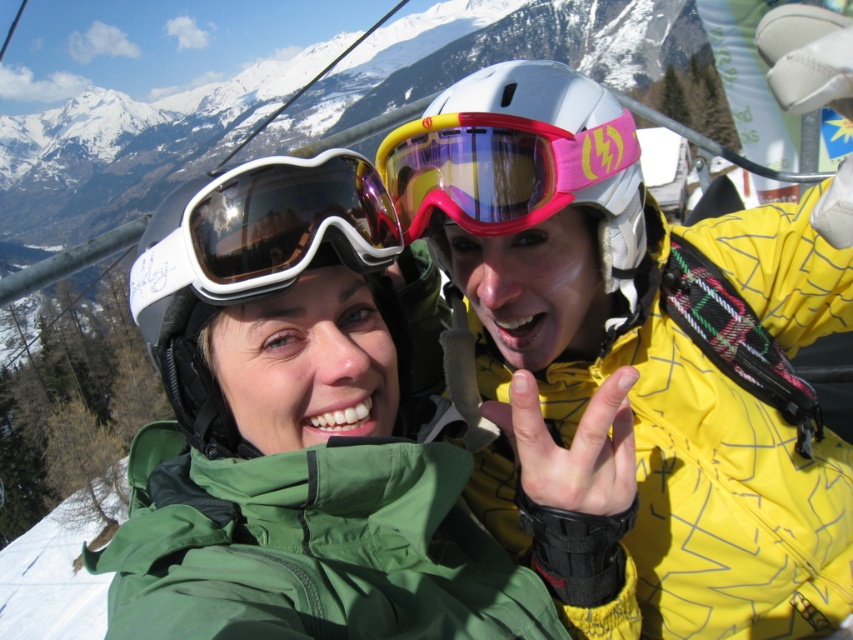
Who is higher up, green fabric jacket at center or pink matte ski goggles at center?

pink matte ski goggles at center

Measure the distance between green fabric jacket at center and pink matte ski goggles at center.

green fabric jacket at center and pink matte ski goggles at center are 6.93 meters apart.

Is point (189, 253) farther from viewer compared to point (505, 209)?

No.

Where is `green fabric jacket at center`? The height and width of the screenshot is (640, 853). green fabric jacket at center is located at coordinates (289, 451).

Is green fabric jacket at center to the left of white matte ski goggles at center from the viewer's perspective?

In fact, green fabric jacket at center is to the right of white matte ski goggles at center.

Can you confirm if green fabric jacket at center is positioned above white matte ski goggles at center?

No, green fabric jacket at center is not above white matte ski goggles at center.

Which is behind, point (137, 440) or point (325, 220)?

The point (137, 440) is more distant.

Image resolution: width=853 pixels, height=640 pixels. Identify the location of green fabric jacket at center. (289, 451).

Does white matte ski goggles at center lie behind pink matte ski goggles at center?

No.

Does white matte ski goggles at center have a lesser height compared to pink matte ski goggles at center?

Incorrect, white matte ski goggles at center's height does not fall short of pink matte ski goggles at center's.

The height and width of the screenshot is (640, 853). In order to click on white matte ski goggles at center in this screenshot , I will do `click(260, 230)`.